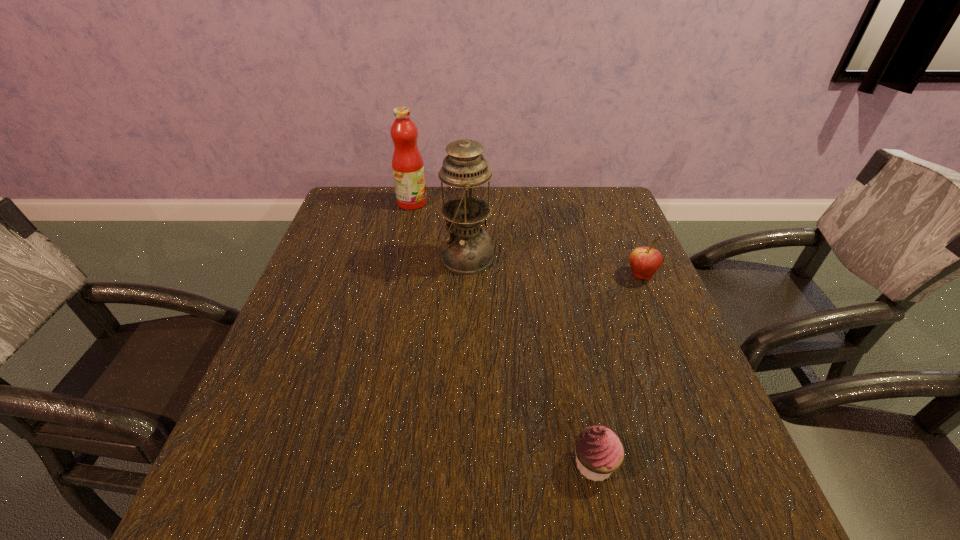
Where is `vacant space that satisfies the following two spatial constraints: 1. on the front label of the nearest object; 2. on the right side of the farthest object`? The width and height of the screenshot is (960, 540). vacant space that satisfies the following two spatial constraints: 1. on the front label of the nearest object; 2. on the right side of the farthest object is located at coordinates (355, 464).